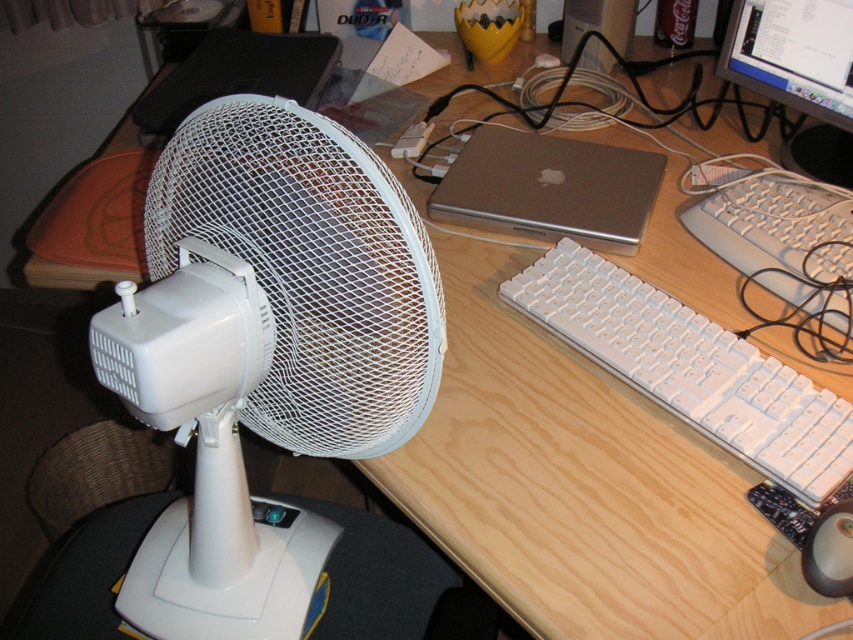
You are sitting at the desk and want to reach for either the white plastic fan at left or the satin silver laptop at center. Which object will your hand encounter first?

The white plastic fan at left is closer to the viewer than the satin silver laptop at center, so your hand will encounter the white plastic fan at left first.